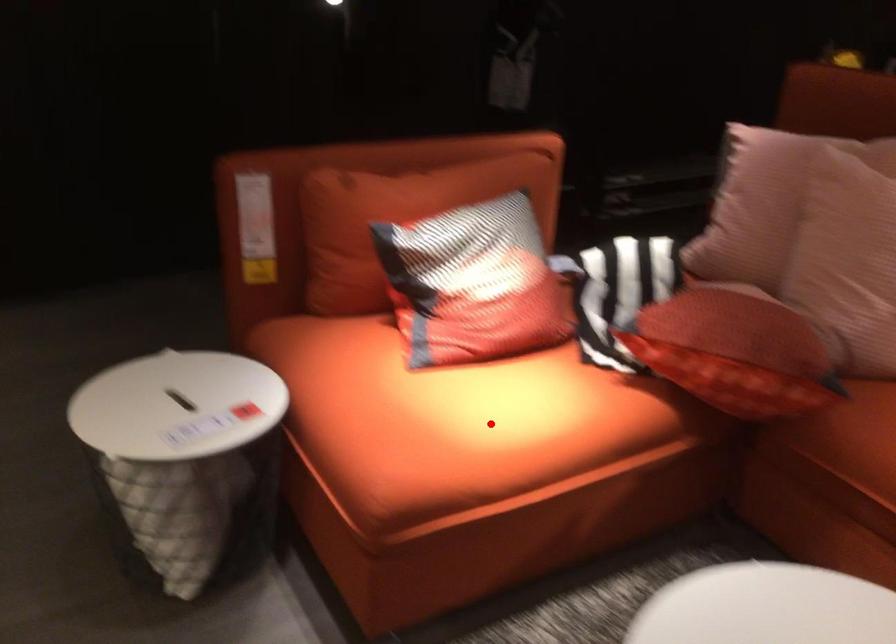
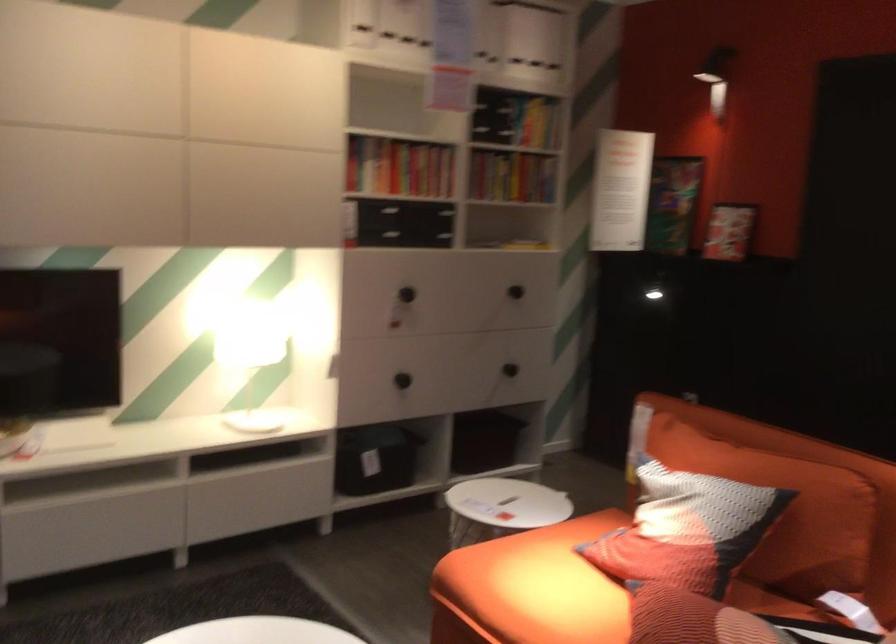
Question: I am providing you with two images of the same scene from different viewpoints. Image1 has a red point marked. In image2, the corresponding 3D location appears at what relative position? Reply with the corresponding letter.

Choices:
 (A) Closer
 (B) Farther

Answer: (B)